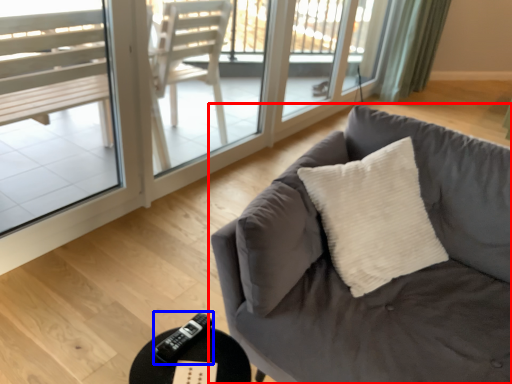
Question: Among these objects, which one is farthest to the camera, studio couch (highlighted by a red box) or remote (highlighted by a blue box)?

Choices:
 (A) studio couch
 (B) remote

Answer: (B)